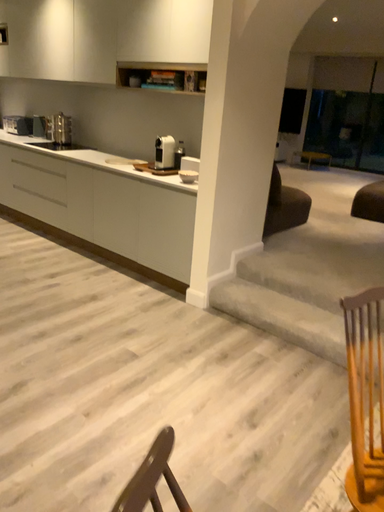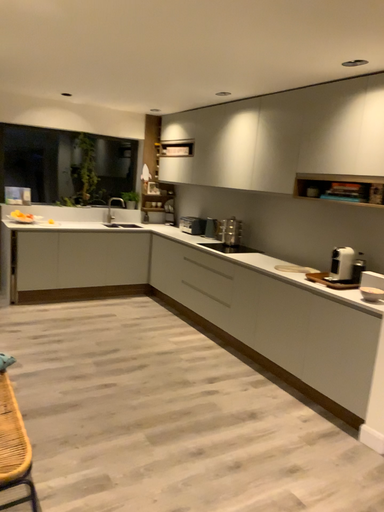
Question: Which way did the camera rotate in the video?

Choices:
 (A) rotated left
 (B) rotated right

Answer: (A)